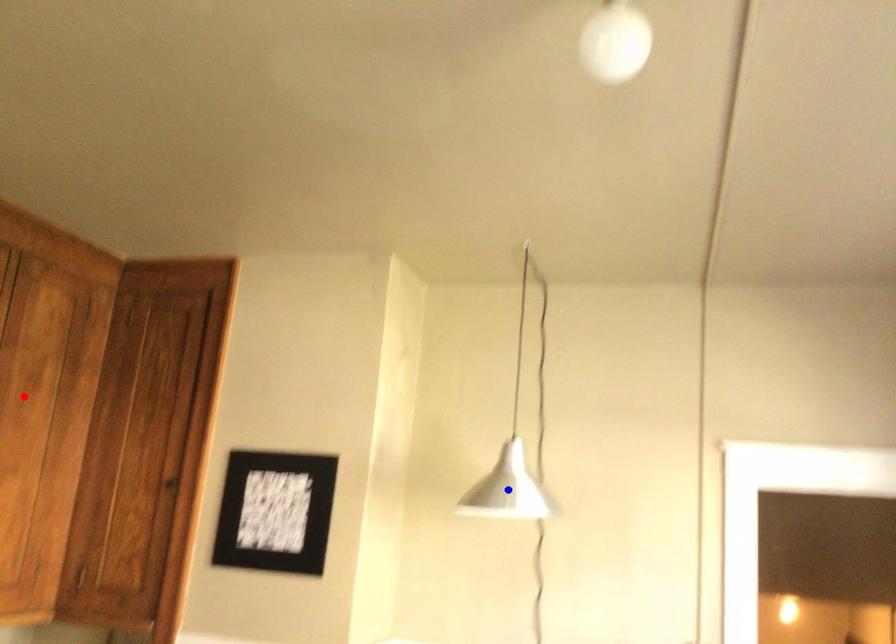
Question: In the image, two points are highlighted. Which point is nearer to the camera? Reply with the corresponding letter.

Choices:
 (A) blue point
 (B) red point

Answer: (B)